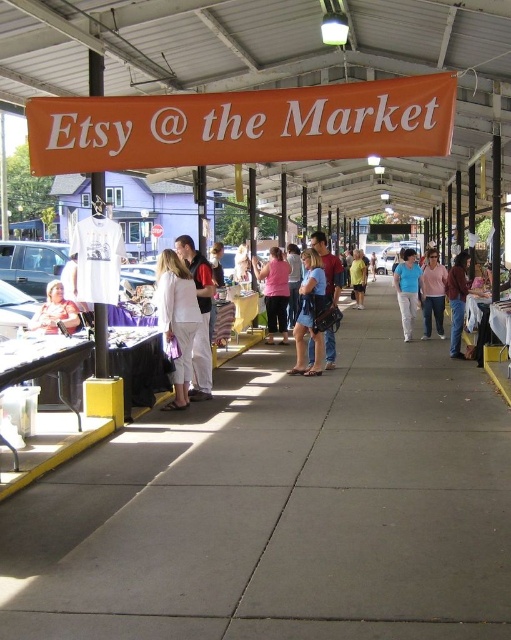
Question: Does white cotton pants at center have a greater width compared to blue cotton shirt at center?

Choices:
 (A) yes
 (B) no

Answer: (B)

Question: Among these points, which one is farthest from the camera?

Choices:
 (A) (350, 273)
 (B) (429, 292)
 (C) (313, 349)

Answer: (A)

Question: Considering the real-world distances, which object is closest to the pink cotton shirt at center?

Choices:
 (A) pink fabric shirt at center
 (B) gray concrete sidewalk at center
 (C) white matte pants at center
 (D) yellow cotton shirt at center

Answer: (A)

Question: Which object is farther from the camera taking this photo?

Choices:
 (A) pink fabric shirt at center
 (B) matte pink shirt at lower left
 (C) pink cotton shirt at center
 (D) yellow cotton shirt at center

Answer: (D)

Question: Can you confirm if white cotton pants at center is thinner than yellow cotton shirt at center?

Choices:
 (A) yes
 (B) no

Answer: (A)

Question: Can you confirm if white matte pants at center is positioned below blue denim jeans at center?

Choices:
 (A) no
 (B) yes

Answer: (B)